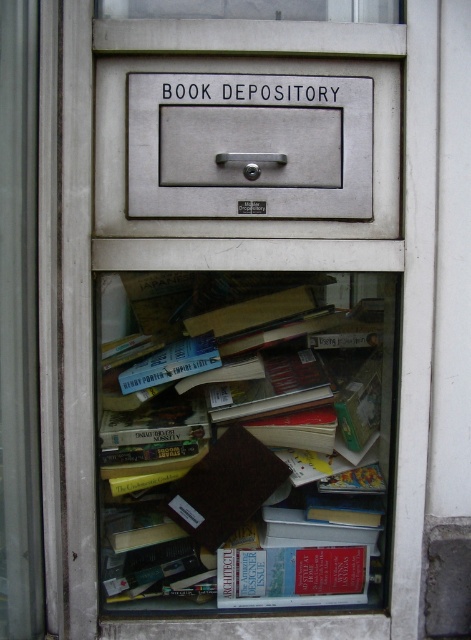
Does brown paper bag at center appear under metallic gray drawer at upper center?

Indeed, brown paper bag at center is positioned under metallic gray drawer at upper center.

Who is more distant from viewer, (344, 369) or (229, 193)?

Point (344, 369)

Find the location of a particular element. This screenshot has width=471, height=640. brown paper bag at center is located at coordinates pyautogui.click(x=257, y=445).